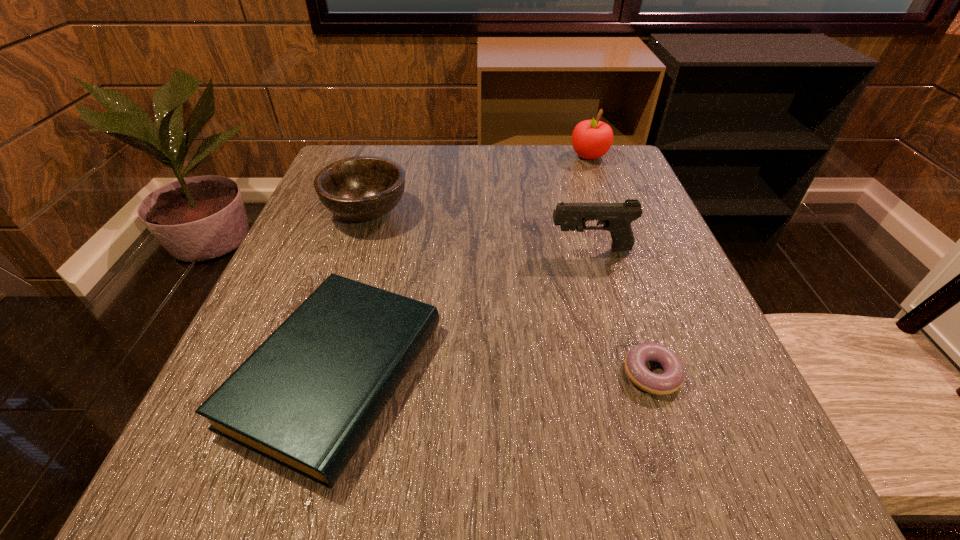
Find the location of a particular element. The width and height of the screenshot is (960, 540). blank area located 0.120m on the front of the bowl is located at coordinates (345, 279).

At what (x,y) coordinates should I click in order to perform the action: click on vacant area located on the back of the book. Please return your answer as a coordinate pair (x, y). The height and width of the screenshot is (540, 960). Looking at the image, I should click on (392, 177).

Where is `free space located on the back of the shortest object`? free space located on the back of the shortest object is located at coordinates (633, 316).

Find the location of a particular element. apple that is at the far edge is located at coordinates (591, 139).

Where is `bowl that is at the far edge`? This screenshot has width=960, height=540. bowl that is at the far edge is located at coordinates (361, 188).

Find the location of a particular element. The height and width of the screenshot is (540, 960). object situated at the near edge is located at coordinates (306, 398).

Image resolution: width=960 pixels, height=540 pixels. Find the location of `bowl positioned at the left edge`. bowl positioned at the left edge is located at coordinates (361, 188).

Locate an element on the screen. Image resolution: width=960 pixels, height=540 pixels. book present at the left edge is located at coordinates (306, 398).

Locate an element on the screen. Image resolution: width=960 pixels, height=540 pixels. apple present at the right edge is located at coordinates (591, 139).

At what (x,y) coordinates should I click in order to perform the action: click on pistol that is at the right edge. Please return your answer as a coordinate pair (x, y). Image resolution: width=960 pixels, height=540 pixels. Looking at the image, I should click on (616, 218).